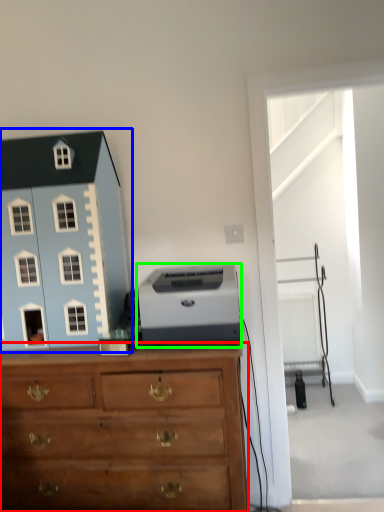
Question: Based on their relative distances, which object is nearer to chest of drawers (highlighted by a red box)? Choose from toy (highlighted by a blue box) and printer (highlighted by a green box).

Choices:
 (A) toy
 (B) printer

Answer: (B)